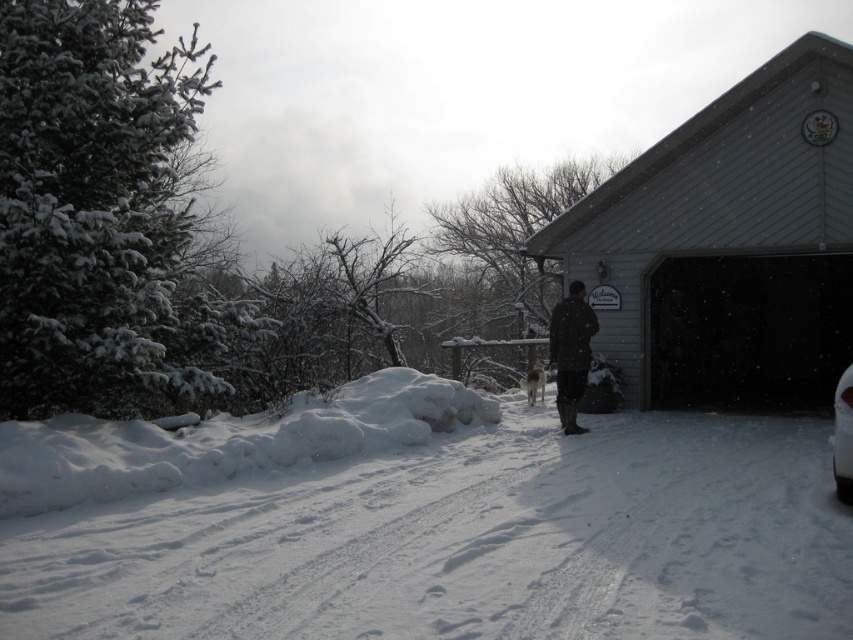
Who is higher up, gray siding garage at upper right or white glossy car at lower right?

gray siding garage at upper right

Consider the image. Is gray siding garage at upper right taller than white glossy car at lower right?

Yes.

Is point (732, 221) more distant than point (839, 401)?

Yes, it is.

Where is `gray siding garage at upper right`? gray siding garage at upper right is located at coordinates (729, 244).

Is black wool coat at center positioned before white glossy car at lower right?

No, black wool coat at center is further to the viewer.

The image size is (853, 640). Identify the location of black wool coat at center. (572, 353).

Is point (561, 321) farther from viewer compared to point (843, 424)?

Yes.

Locate an element on the screen. This screenshot has height=640, width=853. black wool coat at center is located at coordinates (572, 353).

Between point (746, 221) and point (584, 332), which one is positioned behind?

Point (746, 221)

From the picture: Is gray siding garage at upper right taller than black wool coat at center?

Yes, gray siding garage at upper right is taller than black wool coat at center.

Locate an element on the screen. gray siding garage at upper right is located at coordinates (729, 244).

At what (x,y) coordinates should I click in order to perform the action: click on gray siding garage at upper right. Please return your answer as a coordinate pair (x, y). This screenshot has height=640, width=853. Looking at the image, I should click on (729, 244).